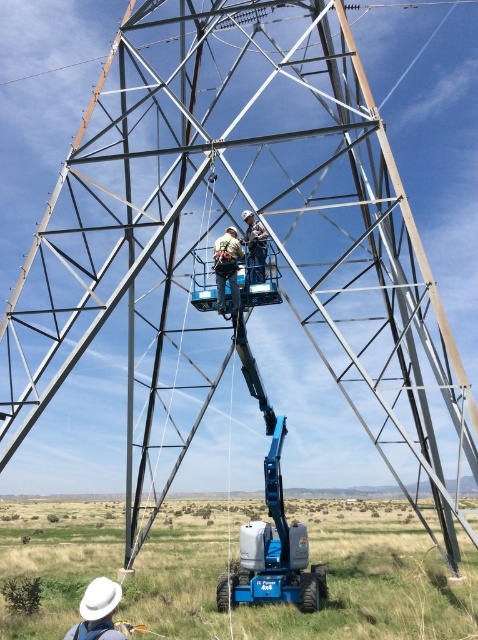
You are a safety inspector checking the equipment in the image. You need to ensure that the blue rubberized bucket truck at lower center and the light brown fabric safety harness at center are both in good condition. Which object should you check first if you follow the standard procedure of inspecting larger equipment before smaller ones?

The blue rubberized bucket truck at lower center should be checked first because it is larger than the light brown fabric safety harness at center, and standard procedures prioritize inspecting larger equipment first.

You are a safety inspector standing at the camera position. You need to check if the blue metallic boom lift at lower center is within the 20 meters safety zone. Is it within the required distance?

The blue metallic boom lift at lower center and camera are 17.17 meters apart from each other. Since 17.17 meters is less than 20 meters, the blue metallic boom lift at lower center is within the required safety zone.